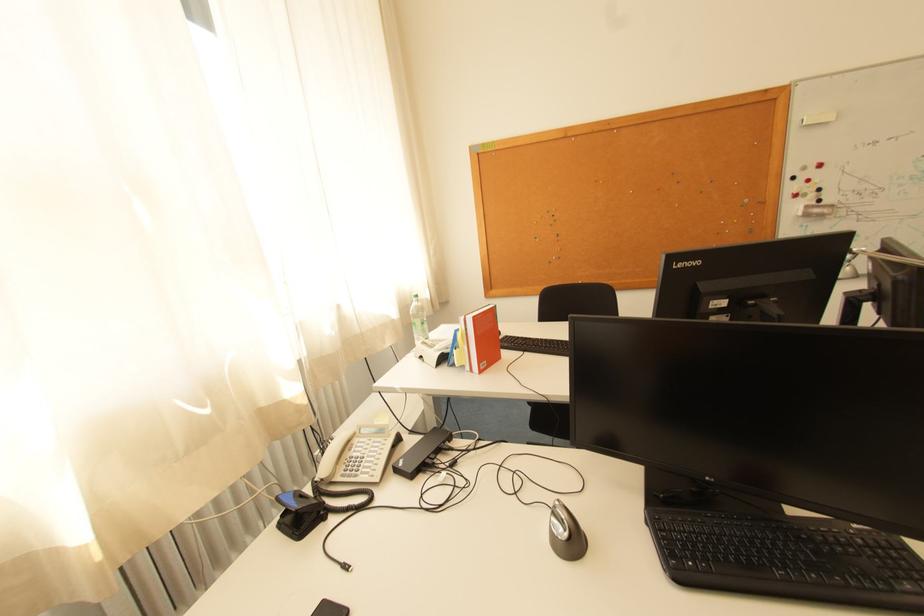
Where would you lift the telephone handset? Please return your answer as a coordinate pair (x, y).

(333, 455)